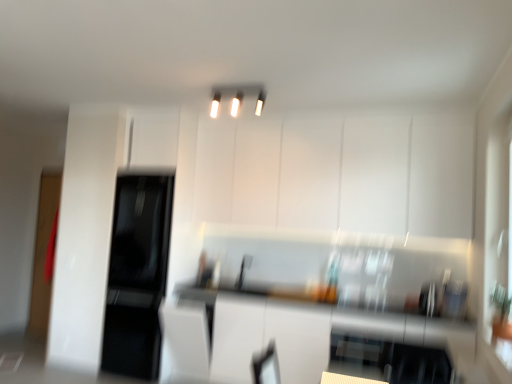
Question: Should I look upward or downward to see black glossy refrigerator at left?

Choices:
 (A) up
 (B) down

Answer: (B)

Question: Is white glossy light fixture at upper center directly adjacent to white glossy countertop at center?

Choices:
 (A) no
 (B) yes

Answer: (A)

Question: Does white glossy light fixture at upper center have a lesser height compared to white glossy countertop at center?

Choices:
 (A) no
 (B) yes

Answer: (B)

Question: From the image's perspective, is white glossy light fixture at upper center under white glossy countertop at center?

Choices:
 (A) no
 (B) yes

Answer: (A)

Question: Is white glossy light fixture at upper center smaller than white glossy countertop at center?

Choices:
 (A) yes
 (B) no

Answer: (A)

Question: Is white glossy light fixture at upper center thinner than white glossy countertop at center?

Choices:
 (A) no
 (B) yes

Answer: (B)

Question: Considering the relative sizes of white glossy light fixture at upper center and white glossy countertop at center in the image provided, is white glossy light fixture at upper center wider than white glossy countertop at center?

Choices:
 (A) yes
 (B) no

Answer: (B)

Question: Is white glossy light fixture at upper center in front of white glossy cabinet at upper center?

Choices:
 (A) yes
 (B) no

Answer: (A)

Question: Is white glossy light fixture at upper center further to camera compared to white glossy cabinet at upper center?

Choices:
 (A) yes
 (B) no

Answer: (B)

Question: From the image's perspective, does white glossy light fixture at upper center appear higher than white glossy cabinet at upper center?

Choices:
 (A) yes
 (B) no

Answer: (A)

Question: Does white glossy light fixture at upper center touch white glossy cabinet at upper center?

Choices:
 (A) yes
 (B) no

Answer: (B)

Question: Is white glossy light fixture at upper center wider than white glossy cabinet at upper center?

Choices:
 (A) yes
 (B) no

Answer: (B)

Question: Considering the relative sizes of white glossy light fixture at upper center and white glossy cabinet at upper center in the image provided, is white glossy light fixture at upper center shorter than white glossy cabinet at upper center?

Choices:
 (A) yes
 (B) no

Answer: (A)

Question: Considering the relative positions of white glossy cabinet at upper center and black glossy refrigerator at left in the image provided, is white glossy cabinet at upper center to the right of black glossy refrigerator at left from the viewer's perspective?

Choices:
 (A) no
 (B) yes

Answer: (B)